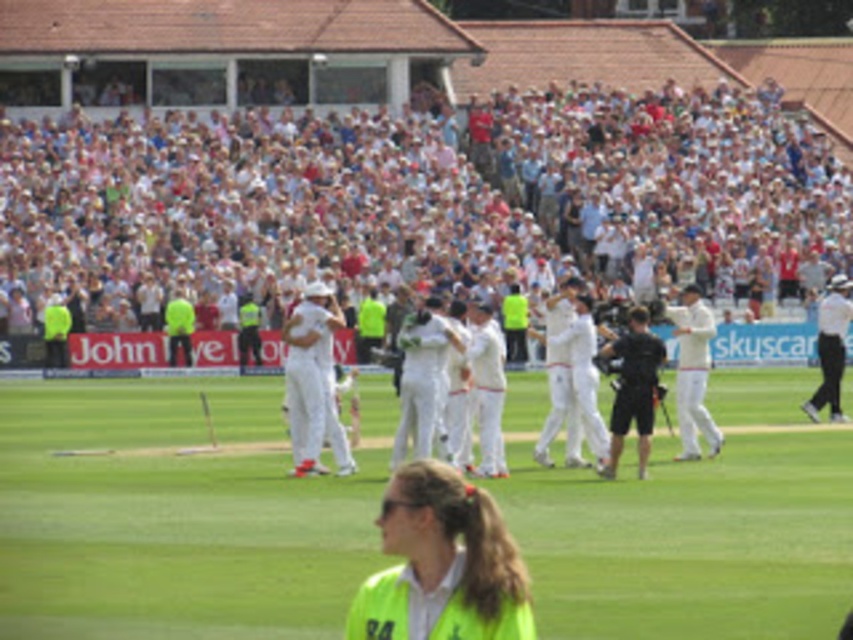
Question: Which is nearer to the white clothed cricketer at center?

Choices:
 (A) black matte camera at center
 (B) yellow reflective vest at lower center

Answer: (A)

Question: Which point is farther from the camera taking this photo?

Choices:
 (A) (407, 540)
 (B) (515, 106)
 (C) (646, 440)
 (D) (309, 420)

Answer: (B)

Question: Is white cotton cricket uniform at center thinner than white clothed figure at right?

Choices:
 (A) yes
 (B) no

Answer: (A)

Question: Which object is positioned farthest from the white clothed cricketer at center?

Choices:
 (A) white clothed figure at center
 (B) white cloth pants at center
 (C) white cloth crowd at upper center
 (D) white clothed figure at right

Answer: (D)

Question: Considering the relative positions of white cloth crowd at upper center and black matte camera at center in the image provided, where is white cloth crowd at upper center located with respect to black matte camera at center?

Choices:
 (A) left
 (B) right

Answer: (A)

Question: Observing the image, what is the correct spatial positioning of white cloth crowd at upper center in reference to white clothed cricketer at center?

Choices:
 (A) left
 (B) right

Answer: (B)